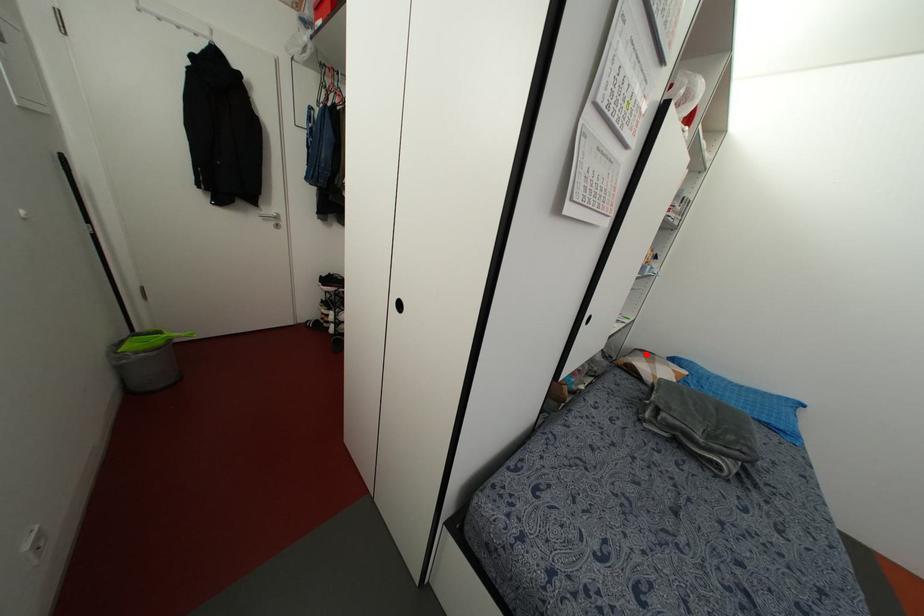
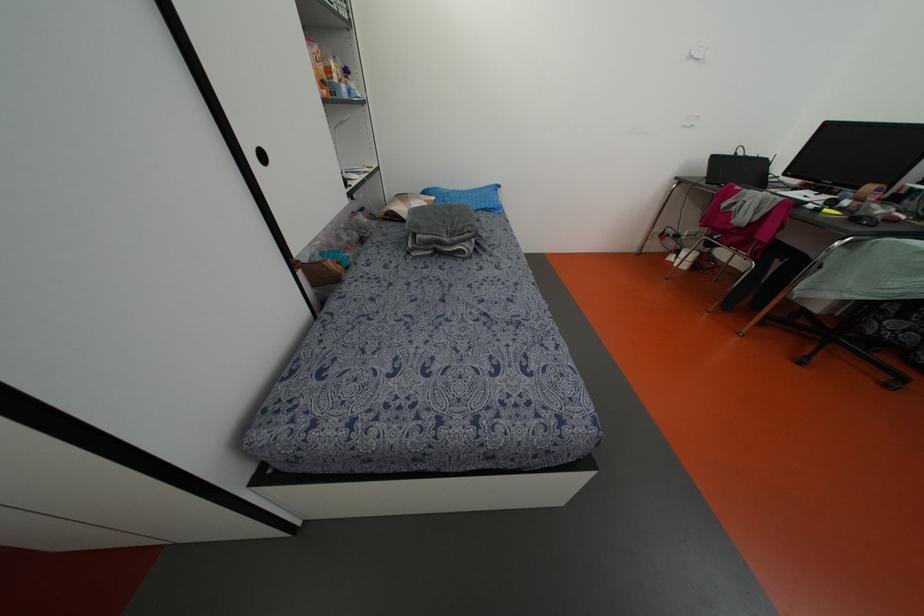
The point at the highlighted location is marked in the first image. Where is the corresponding point in the second image?

(402, 197)